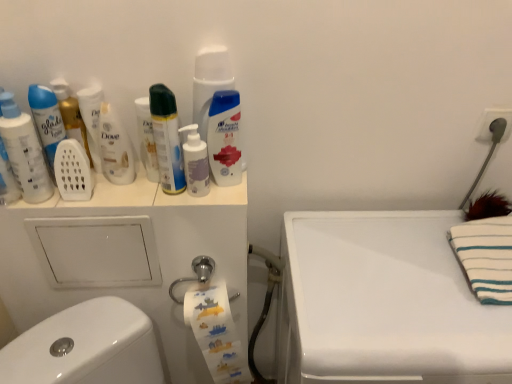
Locate an element on the screen. This screenshot has height=384, width=512. free spot in front of white matte plastic mouthwash at upper left, placed as the 3th mouthwash when sorted from left to right is located at coordinates pos(115,202).